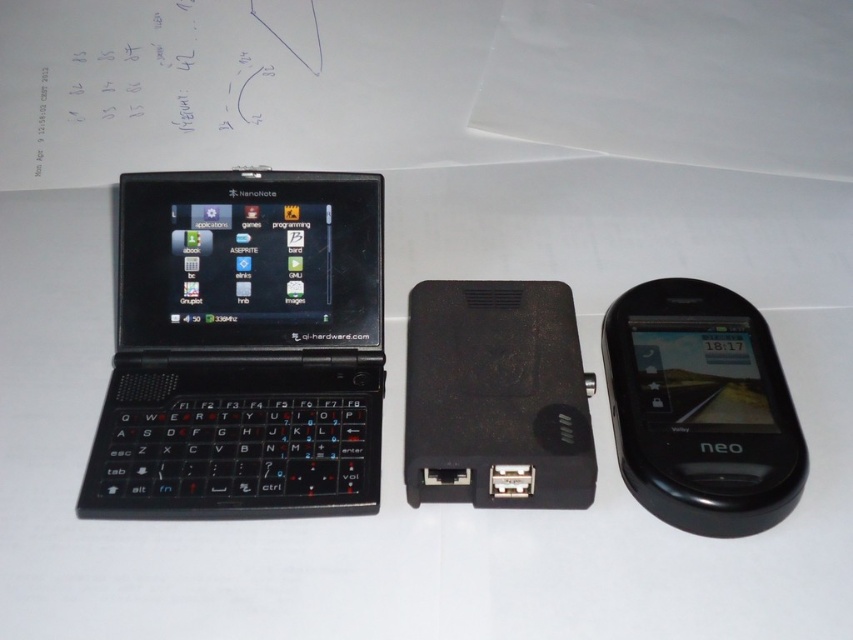
Question: Which of the following is the farthest from the observer?

Choices:
 (A) (675, 394)
 (B) (94, 451)

Answer: (A)

Question: Which point is closer to the camera taking this photo?

Choices:
 (A) (257, 288)
 (B) (786, 401)

Answer: (B)

Question: Is black matte laptop at left wider than black glossy neo phone at right?

Choices:
 (A) no
 (B) yes

Answer: (B)

Question: Is black matte laptop at left to the right of black glossy neo phone at right from the viewer's perspective?

Choices:
 (A) yes
 (B) no

Answer: (B)

Question: Does black matte laptop at left appear under black glossy neo phone at right?

Choices:
 (A) yes
 (B) no

Answer: (B)